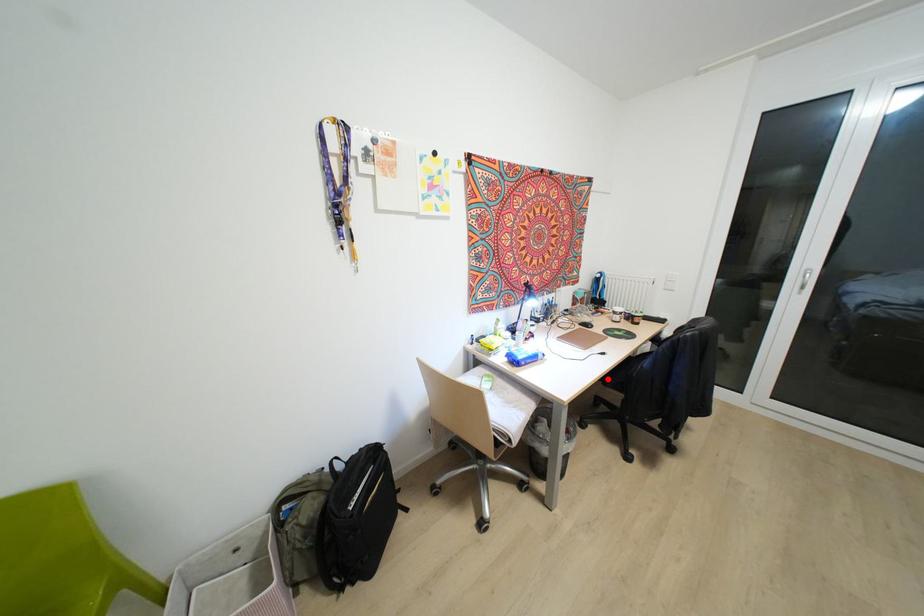
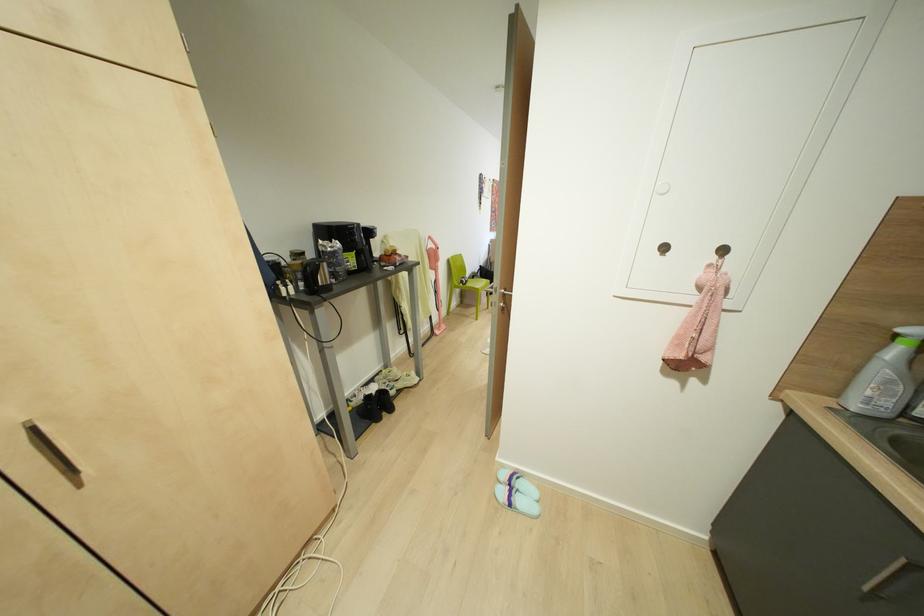
Question: I am providing you with two images of the same scene from different viewpoints. A red point is marked on the first image. Can you still see the location of the red point in image 2?

Choices:
 (A) Yes
 (B) No

Answer: (B)